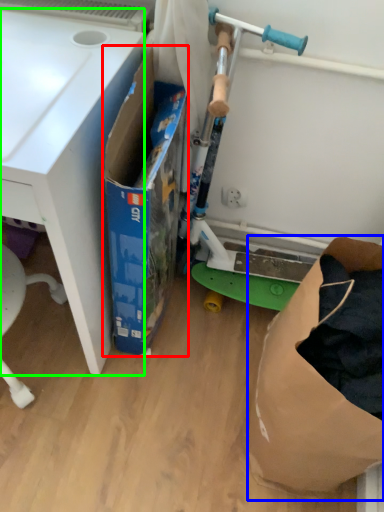
Question: Which object is the farthest from box (highlighted by a red box)? Choose among these: paper bag (highlighted by a blue box) or desk (highlighted by a green box).

Choices:
 (A) paper bag
 (B) desk

Answer: (A)